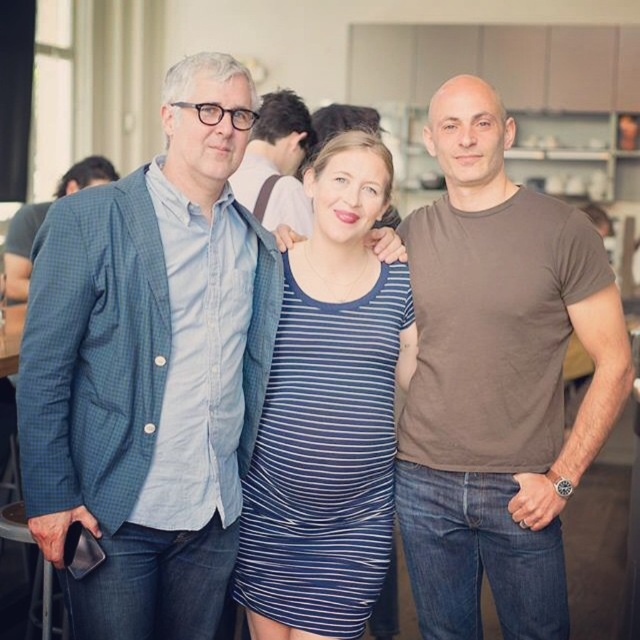
Can you confirm if brown cotton t-shirt at right is smaller than blue striped dress at center?

Actually, brown cotton t-shirt at right might be larger than blue striped dress at center.

Can you confirm if brown cotton t-shirt at right is thinner than blue striped dress at center?

In fact, brown cotton t-shirt at right might be wider than blue striped dress at center.

Is point (499, 179) closer to viewer compared to point (308, 524)?

No, (499, 179) is behind (308, 524).

Identify the location of brown cotton t-shirt at right. pyautogui.click(x=497, y=380).

Is blue striped dress at center above matte blue shirt at center?

Incorrect, blue striped dress at center is not positioned above matte blue shirt at center.

Does point (346, 557) come closer to viewer compared to point (272, 163)?

Yes, it is.

Where is `blue striped dress at center`? This screenshot has width=640, height=640. blue striped dress at center is located at coordinates (328, 413).

Looking at this image, does blue checkered blazer at center have a lesser width compared to brown cotton t-shirt at right?

Yes.

Where is `blue checkered blazer at center`? The height and width of the screenshot is (640, 640). blue checkered blazer at center is located at coordinates pyautogui.click(x=150, y=369).